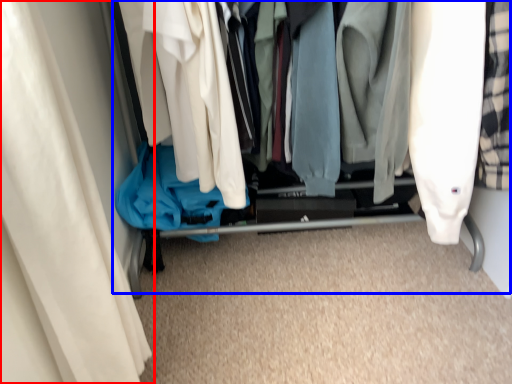
Question: Among these objects, which one is nearest to the camera, curtain (highlighted by a red box) or closet (highlighted by a blue box)?

Choices:
 (A) curtain
 (B) closet

Answer: (A)